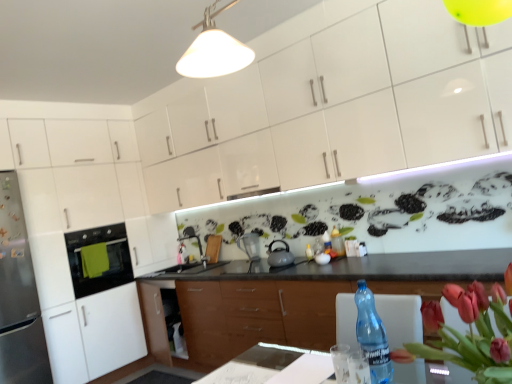
Locate an element on the screen. Image resolution: width=512 pixels, height=384 pixels. empty space that is ontop of black matte oven at left (from a real-world perspective) is located at coordinates (92, 223).